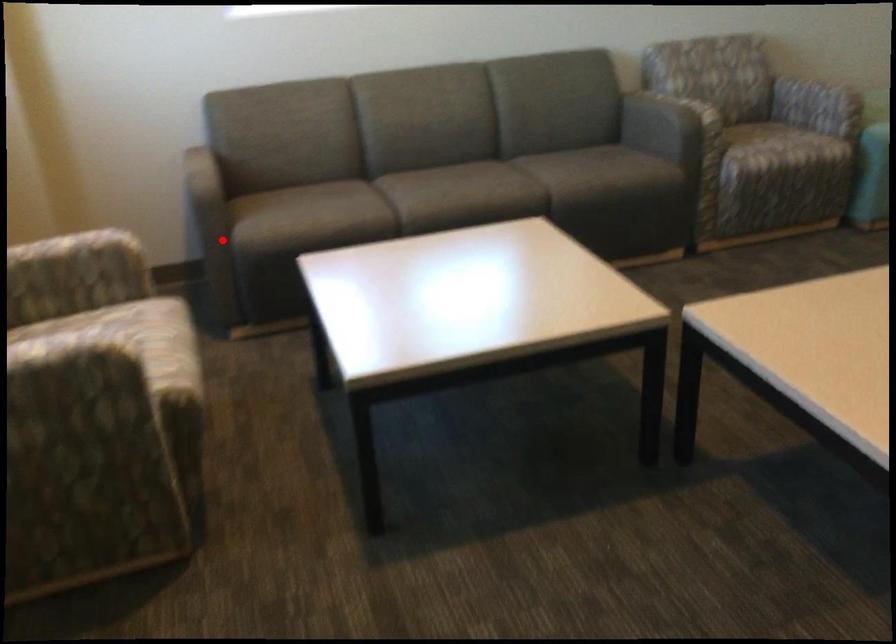
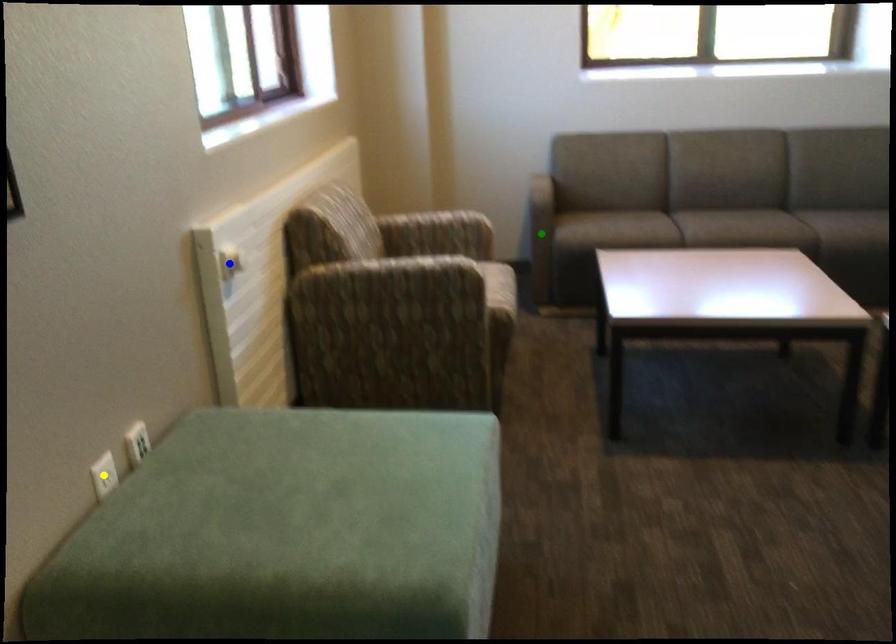
Question: I am providing you with two images of the same scene from different viewpoints. A red point is marked on the first image. You are given multiple points on the second image. Which spot in image 2 lines up with the point in image 1?

Choices:
 (A) blue point
 (B) green point
 (C) yellow point

Answer: (B)